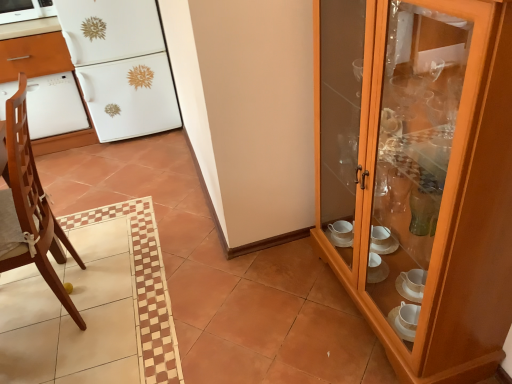
Question: Does wooden cabinet at right appear on the right side of white glossy dishwasher at left?

Choices:
 (A) yes
 (B) no

Answer: (A)

Question: Can you confirm if wooden cabinet at right is smaller than white glossy dishwasher at left?

Choices:
 (A) yes
 (B) no

Answer: (B)

Question: Is wooden cabinet at right not within white glossy dishwasher at left?

Choices:
 (A) yes
 (B) no

Answer: (A)

Question: Considering the relative sizes of wooden cabinet at right and white glossy dishwasher at left in the image provided, is wooden cabinet at right wider than white glossy dishwasher at left?

Choices:
 (A) no
 (B) yes

Answer: (A)

Question: Is wooden cabinet at right taller than white glossy dishwasher at left?

Choices:
 (A) yes
 (B) no

Answer: (A)

Question: Would you say brown wooden chair at left is inside or outside white glossy dishwasher at left?

Choices:
 (A) inside
 (B) outside

Answer: (B)

Question: Is brown wooden chair at left to the left or to the right of white glossy dishwasher at left in the image?

Choices:
 (A) right
 (B) left

Answer: (A)

Question: Based on their sizes in the image, would you say brown wooden chair at left is bigger or smaller than white glossy dishwasher at left?

Choices:
 (A) big
 (B) small

Answer: (B)

Question: From the image's perspective, is brown wooden chair at left above or below white glossy dishwasher at left?

Choices:
 (A) above
 (B) below

Answer: (B)

Question: Is brown wooden chair at left wider or thinner than white glossy microwave at upper left?

Choices:
 (A) thin
 (B) wide

Answer: (B)

Question: Looking at the image, does brown wooden chair at left seem bigger or smaller compared to white glossy microwave at upper left?

Choices:
 (A) big
 (B) small

Answer: (A)

Question: Is point (28, 155) positioned closer to the camera than point (49, 1)?

Choices:
 (A) closer
 (B) farther

Answer: (A)

Question: Relative to white glossy microwave at upper left, is brown wooden chair at left in front or behind?

Choices:
 (A) behind
 (B) front

Answer: (B)

Question: Visually, is white glossy oven at left positioned to the left or to the right of brown wooden chair at left?

Choices:
 (A) left
 (B) right

Answer: (A)

Question: Is white glossy oven at left bigger or smaller than brown wooden chair at left?

Choices:
 (A) small
 (B) big

Answer: (A)